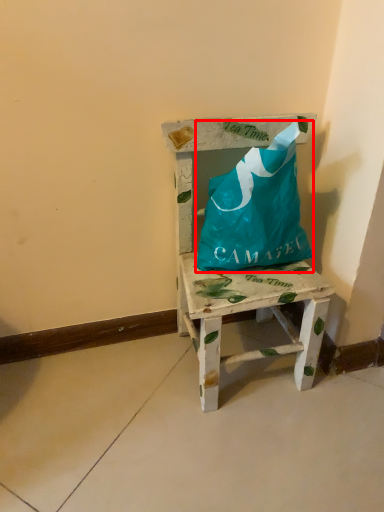
Question: From the image, what is the correct spatial relationship of wrap (annotated by the red box) in relation to furniture?

Choices:
 (A) right
 (B) left

Answer: (A)